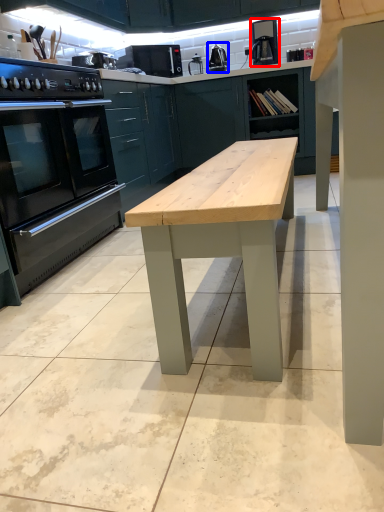
Question: Which object is further to the camera taking this photo, coffee machine (highlighted by a red box) or appliance (highlighted by a blue box)?

Choices:
 (A) coffee machine
 (B) appliance

Answer: (B)